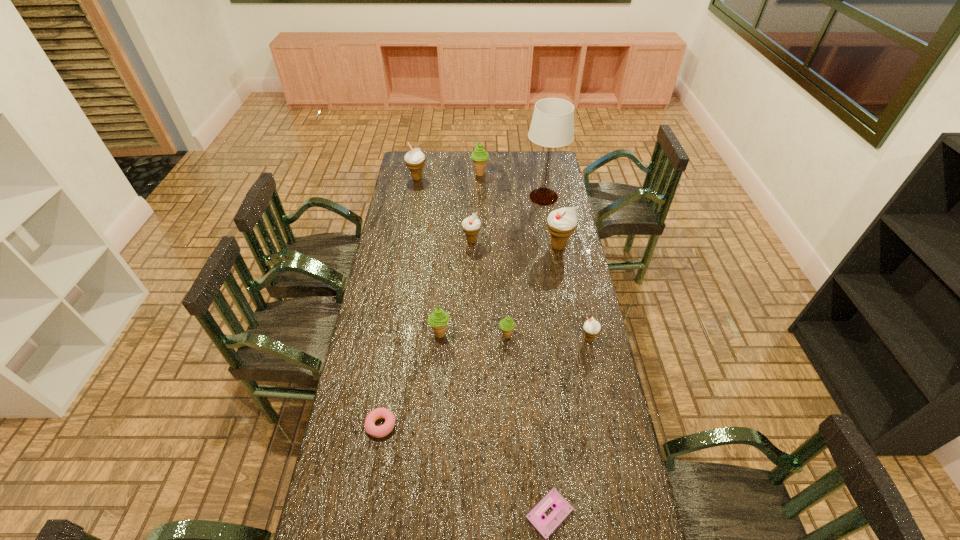
Identify the location of the third white icecream from right to left. This screenshot has width=960, height=540. (471, 226).

Identify the location of the smallest white icecream. (592, 328).

Identify the location of the smallest green icecream. (507, 324).

The width and height of the screenshot is (960, 540). Find the location of `the rightmost green icecream`. the rightmost green icecream is located at coordinates (507, 324).

Find the location of a particular element. This screenshot has width=960, height=540. pink doughnut is located at coordinates (375, 431).

Locate an element on the screen. This screenshot has width=960, height=540. doughnut is located at coordinates (375, 431).

Find the location of `free space located above the cylindrical shade of the table lamp`. free space located above the cylindrical shade of the table lamp is located at coordinates (486, 197).

This screenshot has height=540, width=960. What are the coordinates of `vacant space positioned 0.350m above the cylindrical shade of the table lamp` in the screenshot? It's located at (457, 197).

You are a GUI agent. You are given a task and a screenshot of the screen. Output one action in this format:
    pyautogui.click(x=<x>, y=<y>)
    Task: Click on the vacant space located 0.190m above the cylindrical shade of the table lamp
    The height and width of the screenshot is (540, 960).
    Given the screenshot: What is the action you would take?
    pyautogui.click(x=487, y=197)

Find the location of a particular element. The height and width of the screenshot is (540, 960). free space located 0.120m on the front of the biggest white icecream is located at coordinates (564, 275).